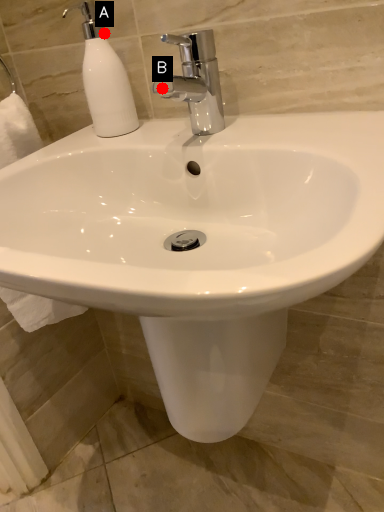
Question: Two points are circled on the image, labeled by A and B beside each circle. Which point is closer to the camera?

Choices:
 (A) A is closer
 (B) B is closer

Answer: (B)